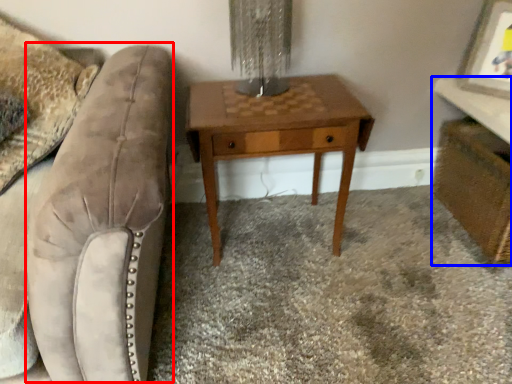
Question: Which object appears farthest to the camera in this image, swivel chair (highlighted by a red box) or vanity (highlighted by a blue box)?

Choices:
 (A) swivel chair
 (B) vanity

Answer: (B)